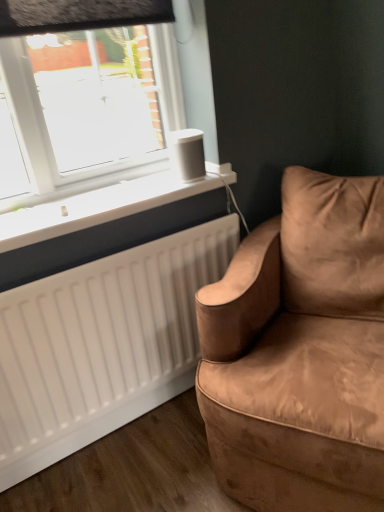
Question: Is white matte speaker at upper center inside the boundaries of white matte radiator at lower left, or outside?

Choices:
 (A) inside
 (B) outside

Answer: (B)

Question: From the image's perspective, relative to white matte radiator at lower left, is white matte speaker at upper center above or below?

Choices:
 (A) below
 (B) above

Answer: (B)

Question: Estimate the real-world distances between objects in this image. Which object is farther from the white matte speaker at upper center?

Choices:
 (A) suede brown couch at right
 (B) white matte radiator at lower left

Answer: (A)

Question: Which object is the farthest from the white matte speaker at upper center?

Choices:
 (A) white matte radiator at lower left
 (B) suede brown couch at right

Answer: (B)